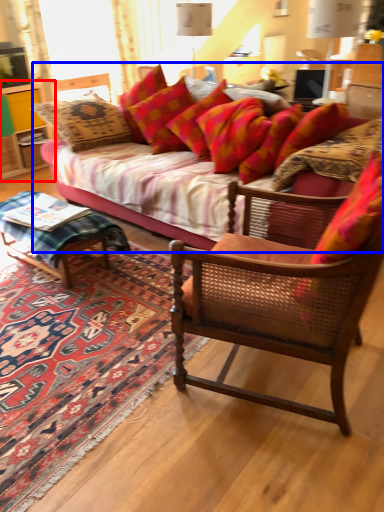
Question: Which point is closer to the camera, cabinetry (highlighted by a red box) or studio couch (highlighted by a blue box)?

Choices:
 (A) cabinetry
 (B) studio couch

Answer: (B)